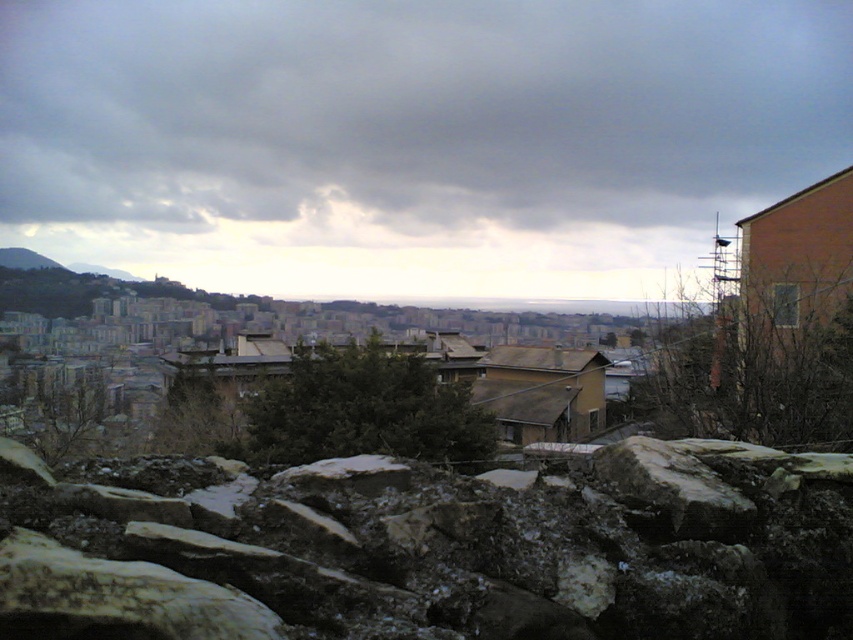
Question: Which point is farther to the camera?

Choices:
 (A) dark gray cloud at upper center
 (B) white rough stone at center
 (C) rough stone wall at lower center

Answer: (A)

Question: Which is farther from the dark gray cloud at upper center?

Choices:
 (A) rough stone wall at lower center
 (B) white rough stone at center

Answer: (B)

Question: Which point is closer to the camera?

Choices:
 (A) white rough stone at center
 (B) rough stone wall at lower center

Answer: (B)

Question: Is dark gray cloud at upper center positioned at the back of white rough stone at center?

Choices:
 (A) no
 (B) yes

Answer: (B)

Question: Can you confirm if rough stone wall at lower center is positioned below white rough stone at center?

Choices:
 (A) no
 (B) yes

Answer: (B)

Question: Can you confirm if rough stone wall at lower center is positioned to the left of white rough stone at center?

Choices:
 (A) no
 (B) yes

Answer: (B)